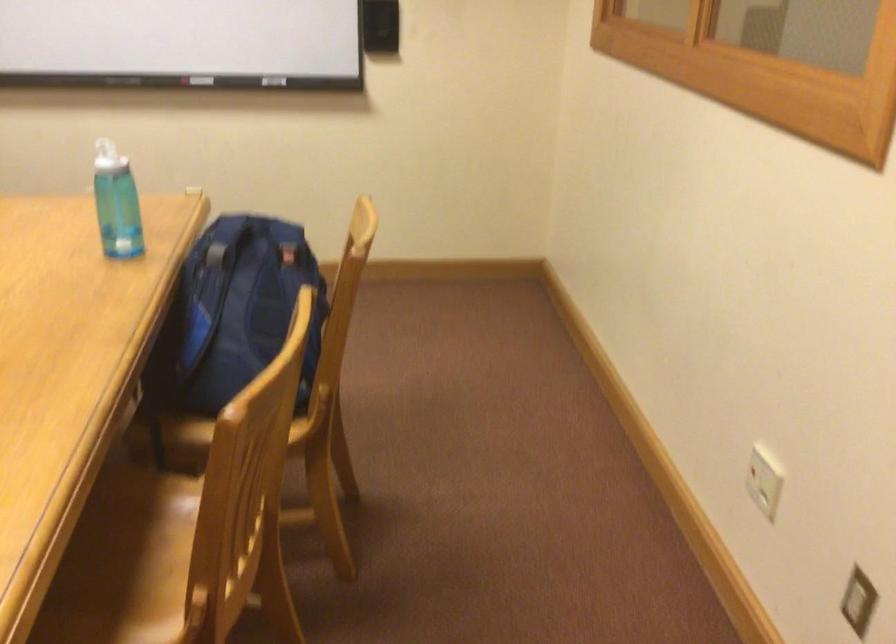
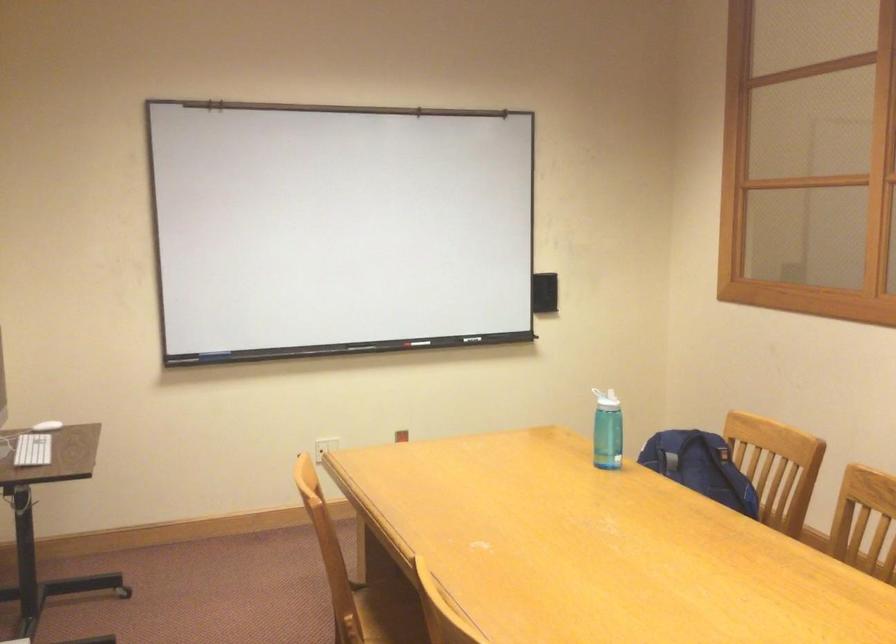
Where in the second image is the point corresponding to point (211, 84) from the first image?

(420, 343)